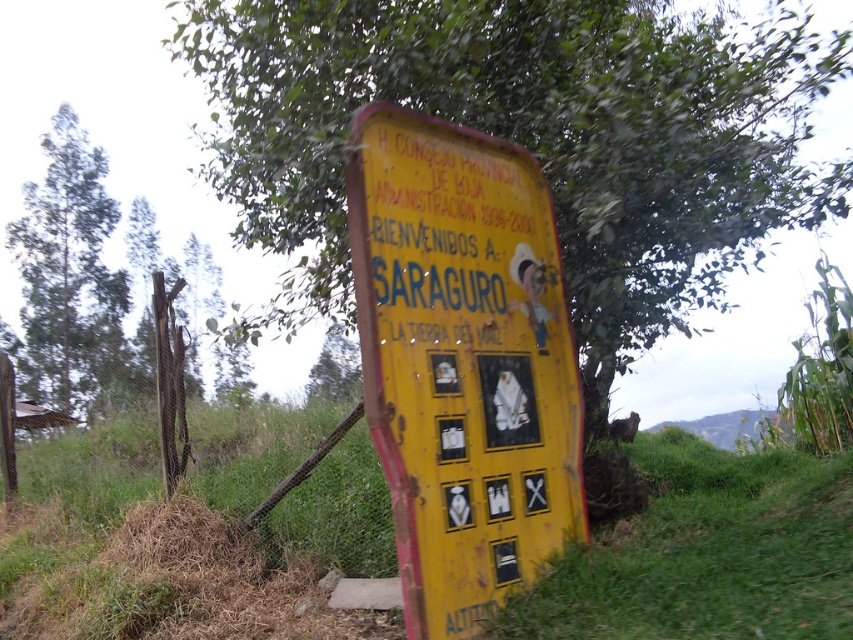
Question: Where is green leafy tree at center located in relation to yellow painted wood sign at center in the image?

Choices:
 (A) above
 (B) below

Answer: (A)

Question: Estimate the real-world distances between objects in this image. Which object is closer to the green leafy tree at left?

Choices:
 (A) green leafy tree at center
 (B) yellow painted wood sign at center

Answer: (A)

Question: Among these objects, which one is farthest from the camera?

Choices:
 (A) green leafy tree at center
 (B) green leafy tree at left

Answer: (B)

Question: Which object is farther from the camera taking this photo?

Choices:
 (A) yellow painted wood sign at center
 (B) green leafy tree at left
 (C) green leafy tree at center

Answer: (B)

Question: From the image, what is the correct spatial relationship of green leafy tree at center in relation to green leafy tree at left?

Choices:
 (A) below
 (B) above

Answer: (B)

Question: From the image, what is the correct spatial relationship of yellow painted wood sign at center in relation to green leafy tree at left?

Choices:
 (A) right
 (B) left

Answer: (A)